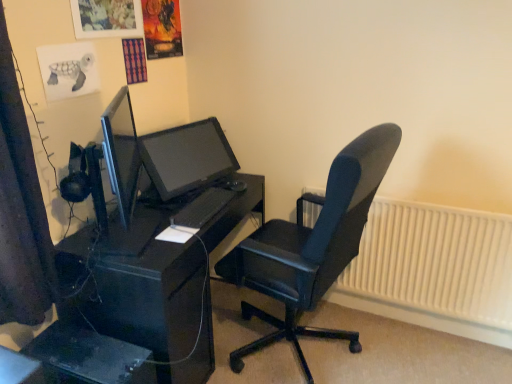
What is the approximate width of watercolor paper turtle at upper left?

It is 0.59 inches.

Identify the location of watercolor paper turtle at upper left. Image resolution: width=512 pixels, height=384 pixels. (68, 70).

What do you see at coordinates (168, 290) in the screenshot? This screenshot has width=512, height=384. I see `black glossy desk at center` at bounding box center [168, 290].

This screenshot has height=384, width=512. What do you see at coordinates (201, 210) in the screenshot?
I see `black matte keyboard at center` at bounding box center [201, 210].

Locate an element on the screen. The image size is (512, 384). white plastic radiator at right is located at coordinates (434, 263).

Find the location of a particular element. The image size is (512, 384). black plastic computer tower at lower left is located at coordinates tap(91, 356).

Is the surface of black fabric curtain at left in direct contact with black plastic computer tower at lower left?

No, black fabric curtain at left is not next to black plastic computer tower at lower left.

At what (x,y) coordinates should I click in order to perform the action: click on computer tower that appears behind the black fabric curtain at left. Please return your answer as a coordinate pair (x, y). This screenshot has height=384, width=512. Looking at the image, I should click on (91, 356).

Is black fabric curtain at left to the left of black plastic computer tower at lower left from the viewer's perspective?

Indeed, black fabric curtain at left is positioned on the left side of black plastic computer tower at lower left.

Is black fabric curtain at left shorter than black plastic computer tower at lower left?

No.

Can you confirm if black glossy desk at center is bigger than watercolor paper turtle at upper left?

Yes.

From the image's perspective, which one is positioned higher, black glossy desk at center or watercolor paper turtle at upper left?

watercolor paper turtle at upper left.

Between black glossy desk at center and watercolor paper turtle at upper left, which one appears on the right side from the viewer's perspective?

black glossy desk at center is more to the right.

Is black glossy desk at center shorter than watercolor paper turtle at upper left?

Incorrect, the height of black glossy desk at center does not fall short of that of watercolor paper turtle at upper left.

Is point (174, 315) more distant than point (508, 228)?

No, it is in front of (508, 228).

Does black glossy desk at center have a smaller size compared to white plastic radiator at right?

Incorrect, black glossy desk at center is not smaller in size than white plastic radiator at right.

Between black glossy desk at center and white plastic radiator at right, which one is positioned behind?

white plastic radiator at right is further from the camera.

Is black glossy desk at center wider than white plastic radiator at right?

Yes.

Which of these two, watercolor paper turtle at upper left or black matte keyboard at center, stands shorter?

black matte keyboard at center is shorter.

Does watercolor paper turtle at upper left have a smaller size compared to black matte keyboard at center?

Yes.

Is watercolor paper turtle at upper left looking in the opposite direction of black matte keyboard at center?

watercolor paper turtle at upper left does not have its back to black matte keyboard at center.

Is watercolor paper turtle at upper left surrounding black matte keyboard at center?

No, black matte keyboard at center is not surrounded by watercolor paper turtle at upper left.

Is white plastic radiator at right turned away from watercolor paper turtle at upper left?

That's not correct — white plastic radiator at right is not looking away from watercolor paper turtle at upper left.

How many degrees apart are the facing directions of white plastic radiator at right and watercolor paper turtle at upper left?

They differ by 89.7 degrees in their facing directions.

Which of these two, white plastic radiator at right or watercolor paper turtle at upper left, stands taller?

With more height is white plastic radiator at right.

Does white plastic radiator at right have a larger size compared to watercolor paper turtle at upper left?

Yes, white plastic radiator at right is bigger than watercolor paper turtle at upper left.

From the picture: Between black matte keyboard at center and black leather office chair at center, which one is positioned in front?

black leather office chair at center is closer to the camera.

Could you tell me if black matte keyboard at center is turned towards black leather office chair at center?

Yes.

Is black matte keyboard at center positioned beyond the bounds of black leather office chair at center?

Indeed, black matte keyboard at center is completely outside black leather office chair at center.

Which is more to the right, black matte keyboard at center or black leather office chair at center?

From the viewer's perspective, black leather office chair at center appears more on the right side.

Based on the photo, is watercolor paper turtle at upper left completely or partially outside of black leather office chair at center?

Yes, watercolor paper turtle at upper left is not within black leather office chair at center.

Are watercolor paper turtle at upper left and black leather office chair at center making contact?

watercolor paper turtle at upper left and black leather office chair at center are not in contact.

Does watercolor paper turtle at upper left turn towards black leather office chair at center?

No, watercolor paper turtle at upper left is not turned towards black leather office chair at center.

This screenshot has height=384, width=512. What are the coordinates of `curtain that appears above the black plastic computer tower at lower left (from a real-world perspective)` in the screenshot? It's located at (21, 210).

Identify the location of poster page lying behind the black glossy desk at center. This screenshot has height=384, width=512. (68, 70).

Considering their positions, is black matte keyboard at center positioned closer to black fabric curtain at left than black plastic computer tower at lower left?

black plastic computer tower at lower left is closer to black fabric curtain at left.

Based on their spatial positions, is black glossy desk at center or white plastic radiator at right closer to black matte keyboard at center?

black glossy desk at center lies closer to black matte keyboard at center than the other object.

From the image, which object appears to be nearer to black glossy desk at center, watercolor paper turtle at upper left or white plastic radiator at right?

watercolor paper turtle at upper left is positioned closer to the anchor black glossy desk at center.

From the image, which object appears to be nearer to black plastic computer tower at lower left, black matte keyboard at center or black leather office chair at center?

The object closer to black plastic computer tower at lower left is black matte keyboard at center.

Looking at the image, which one is located further to white plastic radiator at right, black matte keyboard at center or black leather office chair at center?

Based on the image, black matte keyboard at center appears to be further to white plastic radiator at right.

Looking at the image, which one is located closer to white plastic radiator at right, black matte keyboard at center or black fabric curtain at left?

black matte keyboard at center is closer to white plastic radiator at right.

Which object lies further to the anchor point white plastic radiator at right, black leather office chair at center or black matte keyboard at center?

Based on the image, black matte keyboard at center appears to be further to white plastic radiator at right.

From the image, which object appears to be farther from white plastic radiator at right, black leather office chair at center or watercolor paper turtle at upper left?

The object further to white plastic radiator at right is watercolor paper turtle at upper left.

Find the location of `chair between watercolor paper turtle at upper left and white plastic radiator at right in the horizontal direction`. chair between watercolor paper turtle at upper left and white plastic radiator at right in the horizontal direction is located at coordinates (311, 246).

I want to click on desk situated between watercolor paper turtle at upper left and white plastic radiator at right from left to right, so click(x=168, y=290).

Locate an element on the screen. The height and width of the screenshot is (384, 512). chair between black plastic computer tower at lower left and white plastic radiator at right is located at coordinates (311, 246).

The height and width of the screenshot is (384, 512). I want to click on poster page between black fabric curtain at left and black leather office chair at center, so click(x=68, y=70).